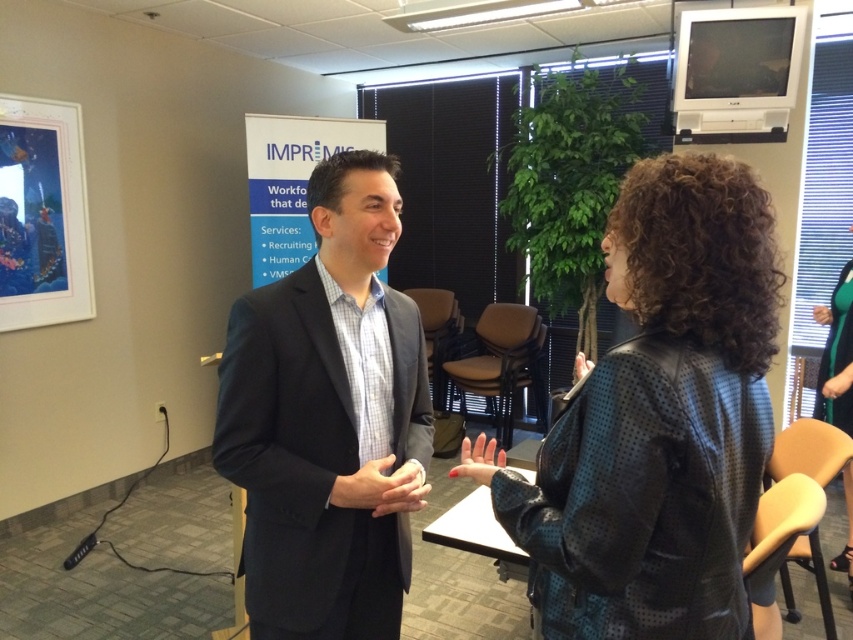
Who is taller, black leather jacket at center or dark blue suit at center?

dark blue suit at center is taller.

Which is behind, point (613, 275) or point (407, 326)?

Point (407, 326)

What are the coordinates of `black leather jacket at center` in the screenshot? It's located at (657, 420).

Is dark blue suit at center smaller than blue paper at center?

Indeed, dark blue suit at center has a smaller size compared to blue paper at center.

Between point (299, 556) and point (248, 196), which one is positioned behind?

Point (248, 196)

Locate an element on the screen. This screenshot has width=853, height=640. dark blue suit at center is located at coordinates tap(328, 419).

Which is more to the left, black leather jacket at center or blue paper at center?

blue paper at center

Between black leather jacket at center and blue paper at center, which one has less height?

Standing shorter between the two is black leather jacket at center.

Where is `black leather jacket at center`? black leather jacket at center is located at coordinates (657, 420).

Identify the location of black leather jacket at center. (657, 420).